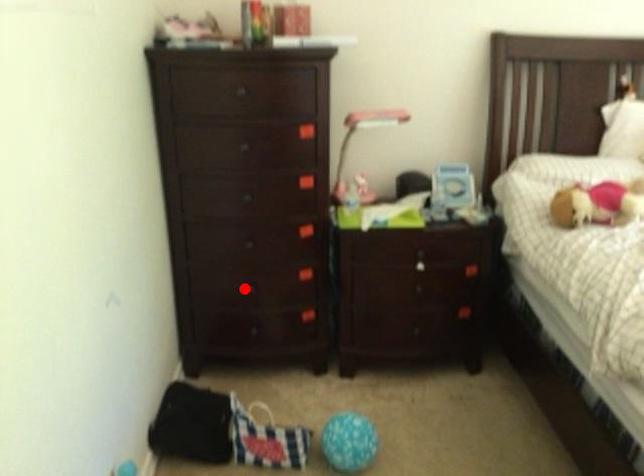
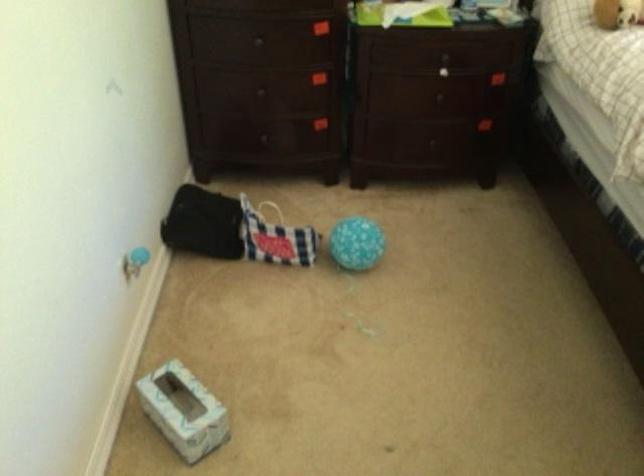
Find the pixel in the second image that matches the highlighted location in the first image.

(260, 90)